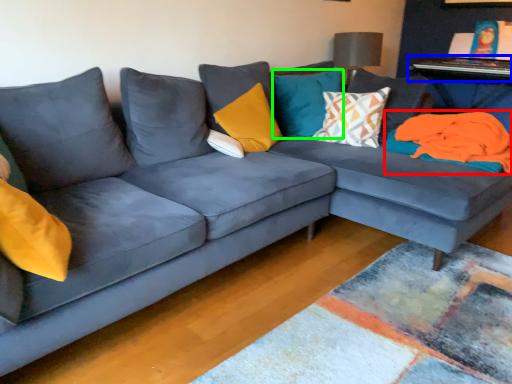
Question: Which is nearer to the material (highlighted by a red box)? table (highlighted by a blue box) or pillow (highlighted by a green box).

Choices:
 (A) table
 (B) pillow

Answer: (B)